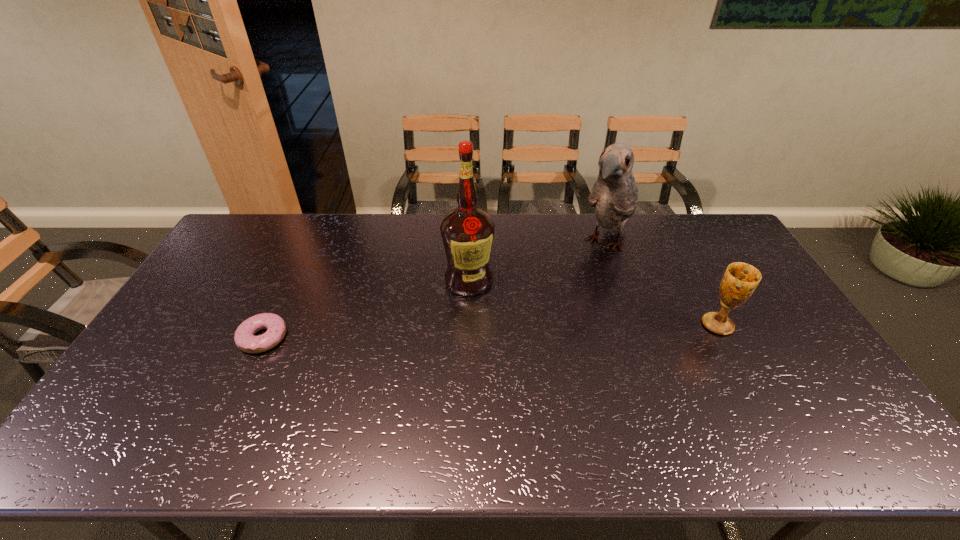
Image resolution: width=960 pixels, height=540 pixels. In order to click on empty location between the rightmost object and the doughnut in this screenshot , I will do `click(491, 331)`.

Find the location of a particular element. The height and width of the screenshot is (540, 960). empty space that is in between the second object from right to left and the rightmost object is located at coordinates (661, 284).

You are a GUI agent. You are given a task and a screenshot of the screen. Output one action in this format:
    pyautogui.click(x=<x>, y=<y>)
    Task: Click on the free space that is in between the alcohol and the shortest object
    The width and height of the screenshot is (960, 540).
    Given the screenshot: What is the action you would take?
    pyautogui.click(x=366, y=309)

Identify which object is located as the third nearest to the rightmost object. Please provide its 2D coordinates. Your answer should be formatted as a tuple, i.e. [(x, y)], where the tuple contains the x and y coordinates of a point satisfying the conditions above.

[(244, 338)]

Select which object is the third closest to the third object from right to left. Please provide its 2D coordinates. Your answer should be formatted as a tuple, i.e. [(x, y)], where the tuple contains the x and y coordinates of a point satisfying the conditions above.

[(740, 280)]

Where is `blank space that satisfies the following two spatial constraints: 1. on the back side of the chalice; 2. on the left side of the leftmost object`? The width and height of the screenshot is (960, 540). blank space that satisfies the following two spatial constraints: 1. on the back side of the chalice; 2. on the left side of the leftmost object is located at coordinates (269, 325).

What are the coordinates of `vacant region that satisfies the following two spatial constraints: 1. on the front side of the chalice; 2. on the left side of the third shortest object` in the screenshot? It's located at [634, 325].

Find the location of a particular element. This screenshot has width=960, height=540. vacant position in the image that satisfies the following two spatial constraints: 1. on the back side of the second object from left to right; 2. on the left side of the second tallest object is located at coordinates (469, 244).

I want to click on free point that satisfies the following two spatial constraints: 1. on the back side of the leftmost object; 2. on the right side of the third object from right to left, so coord(290,280).

Find the location of `free space in the image that satisfies the following two spatial constraints: 1. on the back side of the third object from left to right; 2. on the left side of the doughnut`. free space in the image that satisfies the following two spatial constraints: 1. on the back side of the third object from left to right; 2. on the left side of the doughnut is located at coordinates (307, 244).